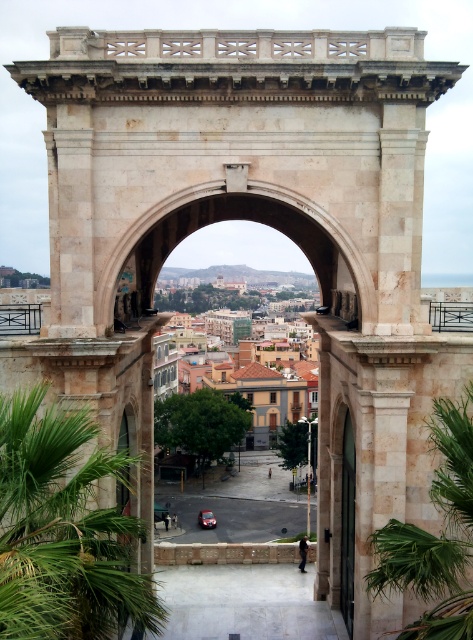
Question: Is green leafy palm tree at left below shiny red car at center?

Choices:
 (A) no
 (B) yes

Answer: (A)

Question: Considering the real-world distances, which object is closest to the green leafy palm tree at left?

Choices:
 (A) white stone archway at center
 (B) green leafy palm at right

Answer: (B)

Question: Does green leafy palm at right have a lesser width compared to white stone archway at center?

Choices:
 (A) yes
 (B) no

Answer: (A)

Question: From the image, what is the correct spatial relationship of white stone archway at center in relation to shiny red car at center?

Choices:
 (A) left
 (B) right

Answer: (B)

Question: Which object is positioned closest to the green leafy palm at right?

Choices:
 (A) green leafy palm tree at left
 (B) white stone archway at center

Answer: (A)

Question: Which object appears farthest from the camera in this image?

Choices:
 (A) shiny red car at center
 (B) white stone archway at center
 (C) green leafy palm at right

Answer: (A)